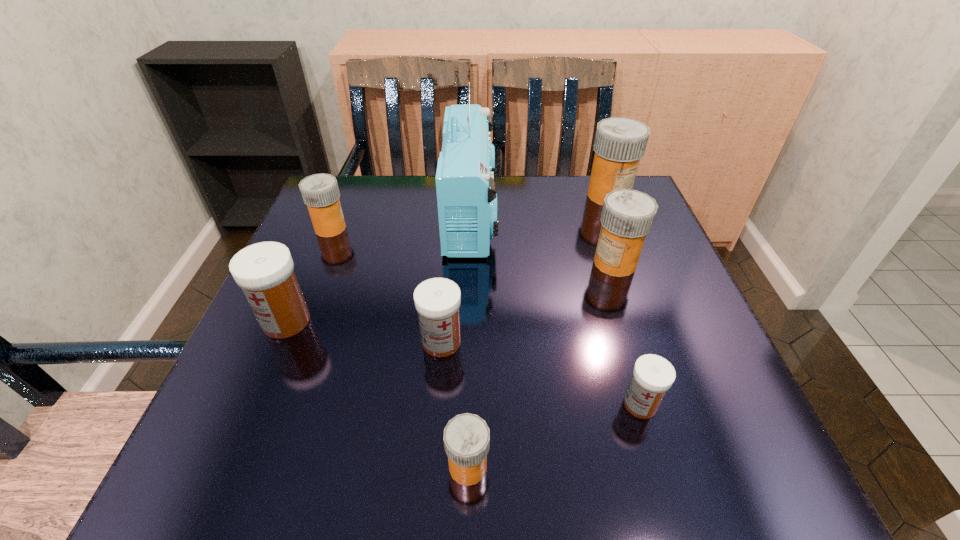
This screenshot has width=960, height=540. Identify the location of free space that is in between the second white medicine from left to right and the third biggest orange medicine. (386, 285).

Identify the location of free space between the leftmost orange medicine and the nearest object. click(x=399, y=347).

Identify the location of vacant area that lies between the radio receiver and the second smallest white medicine. 456,278.

This screenshot has height=540, width=960. I want to click on unoccupied area between the second orange medicine from left to right and the second smallest orange medicine, so click(x=399, y=347).

Locate which object ranks in proximity to the nearest white medicine. Please provide its 2D coordinates. Your answer should be formatted as a tuple, i.e. [(x, y)], where the tuple contains the x and y coordinates of a point satisfying the conditions above.

[(466, 438)]

Identify which object is the seventh nearest to the leftmost white medicine. Please provide its 2D coordinates. Your answer should be formatted as a tuple, i.e. [(x, y)], where the tuple contains the x and y coordinates of a point satisfying the conditions above.

[(620, 143)]

Locate which medicine ranks fifth in proximity to the second white medicine from left to right. Please provide its 2D coordinates. Your answer should be formatted as a tuple, i.e. [(x, y)], where the tuple contains the x and y coordinates of a point satisfying the conditions above.

[(320, 192)]

Identify which medicine is located as the sixth nearest to the nearest object. Please provide its 2D coordinates. Your answer should be formatted as a tuple, i.e. [(x, y)], where the tuple contains the x and y coordinates of a point satisfying the conditions above.

[(620, 143)]

Find the location of a particular element. orange medicine that is the third closest to the second nearest object is located at coordinates (620, 143).

Locate which orange medicine ranks in proximity to the seventh shortest object. Please provide its 2D coordinates. Your answer should be formatted as a tuple, i.e. [(x, y)], where the tuple contains the x and y coordinates of a point satisfying the conditions above.

[(627, 216)]